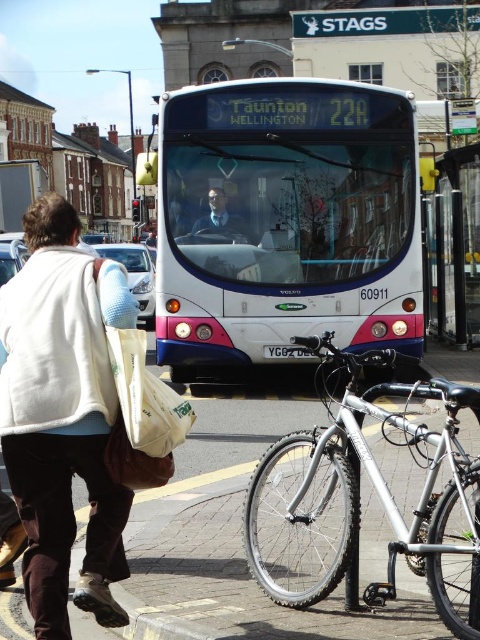
Which is below, white fleece jacket at lower left or matte black jacket at center?

white fleece jacket at lower left

Based on the photo, does white fleece jacket at lower left lie behind matte black jacket at center?

That is False.

Between point (99, 476) and point (240, 241), which one is positioned in front?

Positioned in front is point (99, 476).

Identify the location of white fleece jacket at lower left. The image size is (480, 640). (62, 416).

Image resolution: width=480 pixels, height=640 pixels. What do you see at coordinates (375, 488) in the screenshot?
I see `silver metallic bicycle at lower center` at bounding box center [375, 488].

Can you confirm if silver metallic bicycle at lower center is taller than matte black jacket at center?

Yes, silver metallic bicycle at lower center is taller than matte black jacket at center.

Is point (259, 556) less distant than point (210, 198)?

Yes, it is in front of point (210, 198).

Find the location of a particular element. This screenshot has height=640, width=480. silver metallic bicycle at lower center is located at coordinates (375, 488).

Does white glossy bus at center appear under white fabric bag at lower left?

No, white glossy bus at center is not below white fabric bag at lower left.

Can you confirm if white glossy bus at center is bigger than white fabric bag at lower left?

Indeed, white glossy bus at center has a larger size compared to white fabric bag at lower left.

Between point (410, 300) and point (158, 408), which one is positioned behind?

Positioned behind is point (410, 300).

Find the location of a particular element. The height and width of the screenshot is (640, 480). white glossy bus at center is located at coordinates (286, 221).